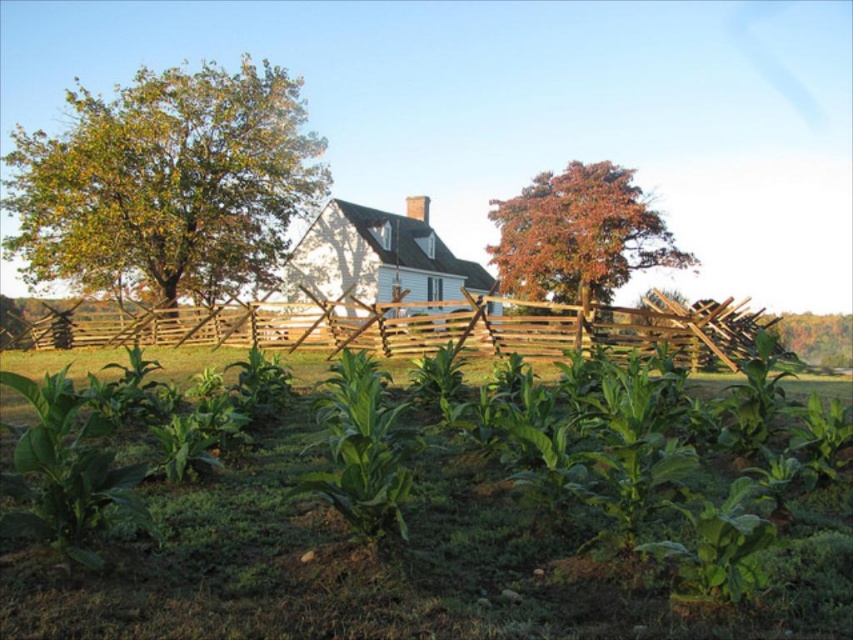
Is wooden fence at center closer to camera compared to orange-brown bark tree at upper center?

Yes, it is in front of orange-brown bark tree at upper center.

Can you confirm if wooden fence at center is wider than orange-brown bark tree at upper center?

Yes.

Is point (747, 340) positioned before point (590, 237)?

Yes, it is.

This screenshot has width=853, height=640. I want to click on wooden fence at center, so pos(422,326).

Is green leafy plants at center smaller than wooden fence at center?

Indeed, green leafy plants at center has a smaller size compared to wooden fence at center.

Can you confirm if green leafy plants at center is positioned above wooden fence at center?

No, green leafy plants at center is not above wooden fence at center.

In the scene shown: Who is more forward, (x=758, y=602) or (x=733, y=316)?

Point (x=758, y=602) is more forward.

This screenshot has width=853, height=640. Identify the location of green leafy plants at center. (444, 532).

Is green leafy plants at center taller than orange-brown bark tree at upper center?

Incorrect, green leafy plants at center's height is not larger of orange-brown bark tree at upper center's.

Between green leafy plants at center and orange-brown bark tree at upper center, which one has less height?

green leafy plants at center

The image size is (853, 640). Describe the element at coordinates (444, 532) in the screenshot. I see `green leafy plants at center` at that location.

The height and width of the screenshot is (640, 853). What are the coordinates of `green leafy plants at center` in the screenshot? It's located at (444, 532).